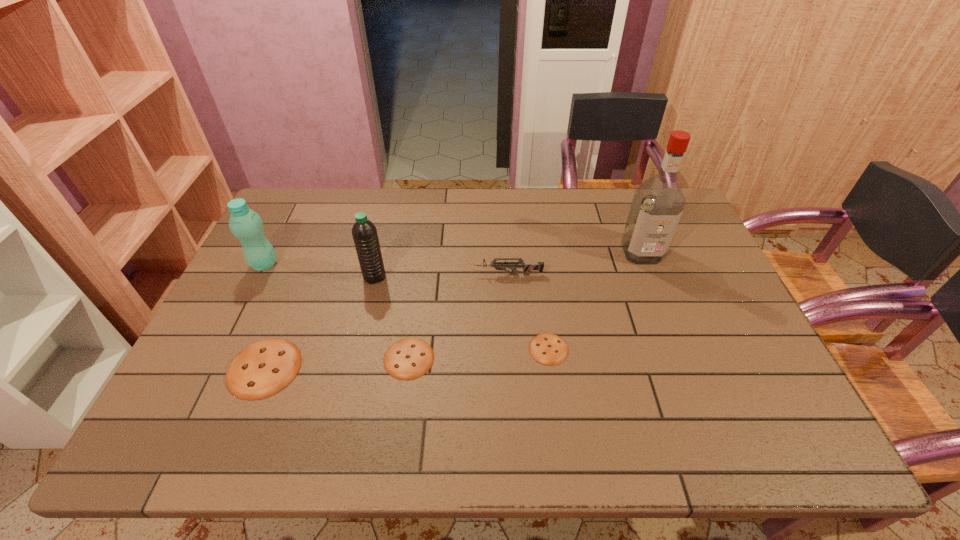
Find the location of `free space between the second shortest object and the water bottle`. free space between the second shortest object and the water bottle is located at coordinates (392, 318).

Identify the location of vacant space that's between the bottle and the sixth tallest object. (337, 312).

What are the coordinates of `unoccupied position between the gun and the second shortest object` in the screenshot? It's located at (459, 316).

The height and width of the screenshot is (540, 960). What are the coordinates of `empty space that is in between the leftmost cookie and the second cookie from left to right` in the screenshot? It's located at (337, 363).

Identify the location of free spot between the third object from left to right and the shortest cookie. (462, 313).

What are the coordinates of `vacant point located between the third shortest object and the bottle` in the screenshot? It's located at pyautogui.click(x=264, y=316).

This screenshot has width=960, height=540. Identify the location of vacant region between the fourth tallest object and the second shortest cookie. (459, 316).

You are a GUI agent. You are given a task and a screenshot of the screen. Output one action in this format:
    pyautogui.click(x=<x>, y=<y>)
    Task: Click on the vacant area that lies between the third shortest object and the bottle
    This screenshot has height=540, width=960.
    Given the screenshot: What is the action you would take?
    pyautogui.click(x=264, y=316)

Locate an element on the screen. free spot between the tallest cookie and the tallest object is located at coordinates pyautogui.click(x=453, y=310).

Choose which object is the fifth nearest neighbor to the bottle. Please provide its 2D coordinates. Your answer should be formatted as a tuple, i.e. [(x, y)], where the tuple contains the x and y coordinates of a point satisfying the conditions above.

[(548, 349)]